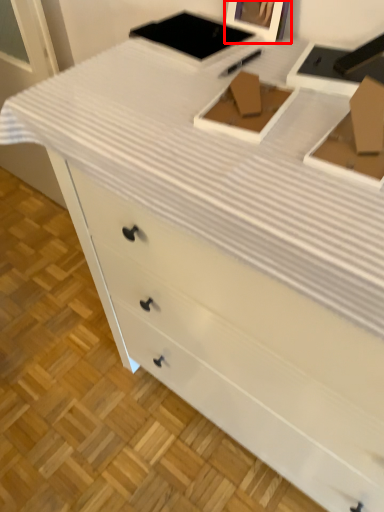
Question: Observing the image, what is the correct spatial positioning of picture frame (annotated by the red box) in reference to box?

Choices:
 (A) right
 (B) left

Answer: (A)